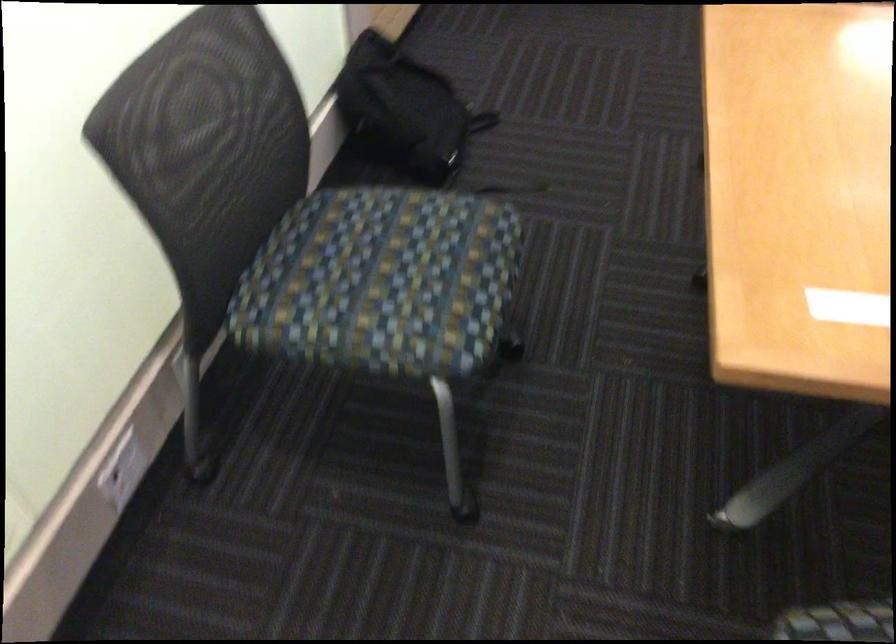
I want to click on black backpack, so click(x=405, y=109).